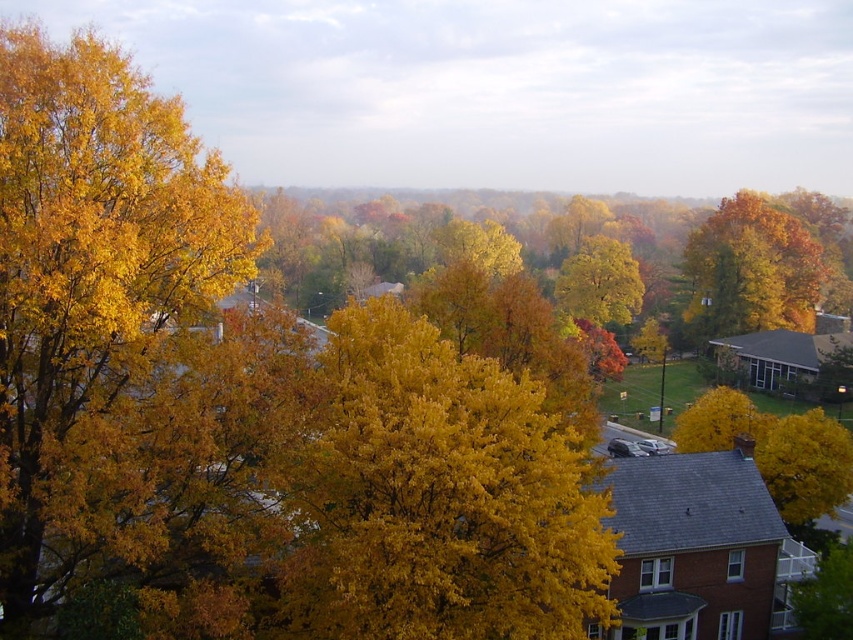
Question: Which of the following is the closest to the observer?

Choices:
 (A) (196, 588)
 (B) (625, 280)
 (C) (374, 637)
 (D) (715, 285)

Answer: (C)

Question: Is golden yellow leaves at left bigger than yellow leafy tree at center?

Choices:
 (A) yes
 (B) no

Answer: (B)

Question: Does yellow leafy tree at center appear on the left side of golden yellow leaves at center?

Choices:
 (A) no
 (B) yes

Answer: (B)

Question: Is golden yellow leaves at left bigger than golden yellow leaves at center?

Choices:
 (A) yes
 (B) no

Answer: (B)

Question: Which of the following is the closest to the observer?

Choices:
 (A) golden yellow leaves at left
 (B) golden yellow leaves at center
 (C) golden yellow leaves at upper right

Answer: (A)

Question: Among these points, which one is farthest from the camera?

Choices:
 (A) (x=39, y=536)
 (B) (x=724, y=196)
 (C) (x=453, y=451)

Answer: (B)